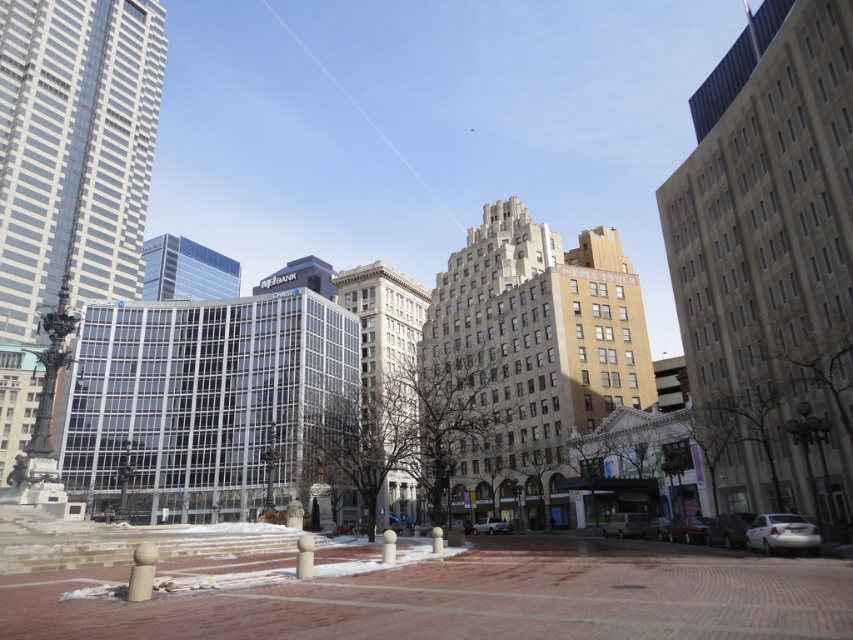
In the scene shown: You are a pedestrian standing on the plaza and want to take a photo of the clear glass skyscraper at center without any obstructions. Is the white glossy sedan at lower right blocking your view of the skyscraper?

The white glossy sedan at lower right is behind the clear glass skyscraper at center, so it won not block your view of the skyscraper.

You are a pedestrian standing on the plaza and want to cross to the statue area. There is a metallic silver car at lower right and a white matte truck at center. Which vehicle is closer to your path?

The metallic silver car at lower right is above the white matte truck at center, so the truck is closer to your path as it is positioned lower in the scene.